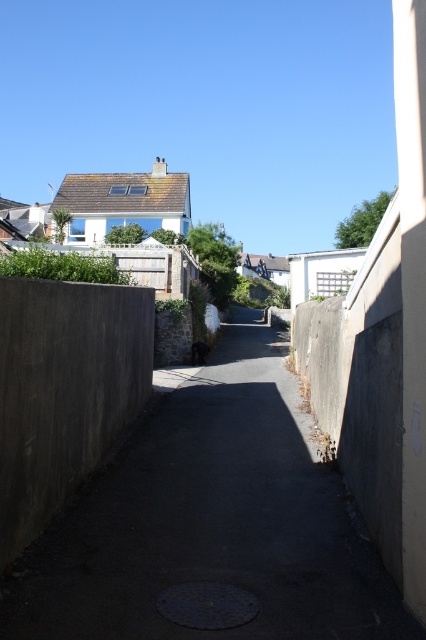
Question: Can you confirm if dark concrete path at center is smaller than concrete wall at left?

Choices:
 (A) yes
 (B) no

Answer: (B)

Question: Can you confirm if dark concrete path at center is positioned to the right of concrete wall at left?

Choices:
 (A) no
 (B) yes

Answer: (B)

Question: Which object appears closest to the camera in this image?

Choices:
 (A) concrete wall at left
 (B) dark concrete path at center

Answer: (B)

Question: Which of the following is the farthest from the observer?

Choices:
 (A) concrete wall at left
 (B) dark concrete path at center

Answer: (A)

Question: In this image, where is dark concrete path at center located relative to concrete wall at left?

Choices:
 (A) above
 (B) below

Answer: (B)

Question: Which of the following is the closest to the observer?

Choices:
 (A) (245, 417)
 (B) (29, 403)

Answer: (B)